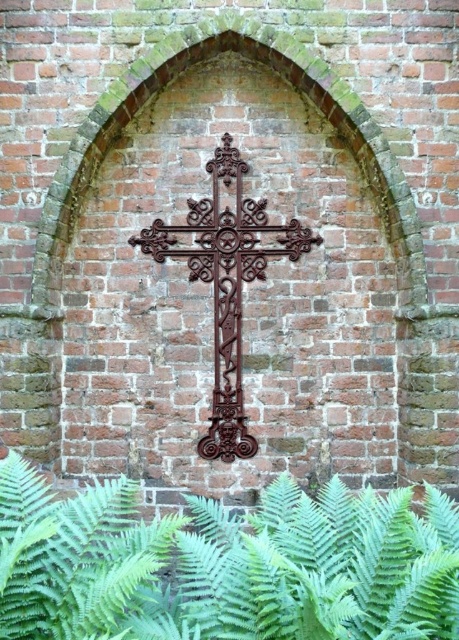
Does green leafy fern at lower center come behind rusty metal cross at center?

No, green leafy fern at lower center is closer to the viewer.

This screenshot has width=459, height=640. In order to click on green leafy fern at lower center in this screenshot , I will do `click(224, 563)`.

Does point (367, 625) lie behind point (138, 241)?

No, (367, 625) is closer to viewer.

Where is `green leafy fern at lower center`? green leafy fern at lower center is located at coordinates (224, 563).